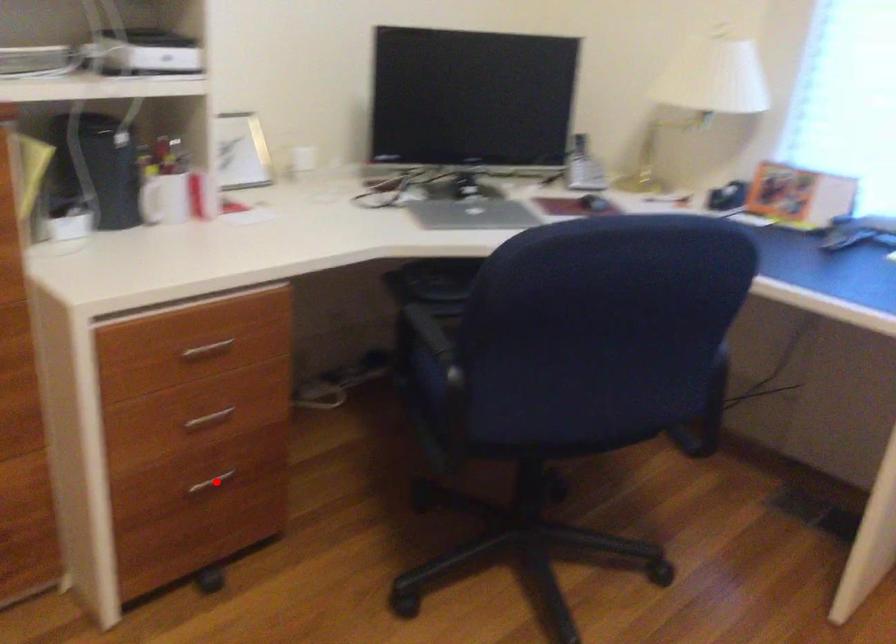
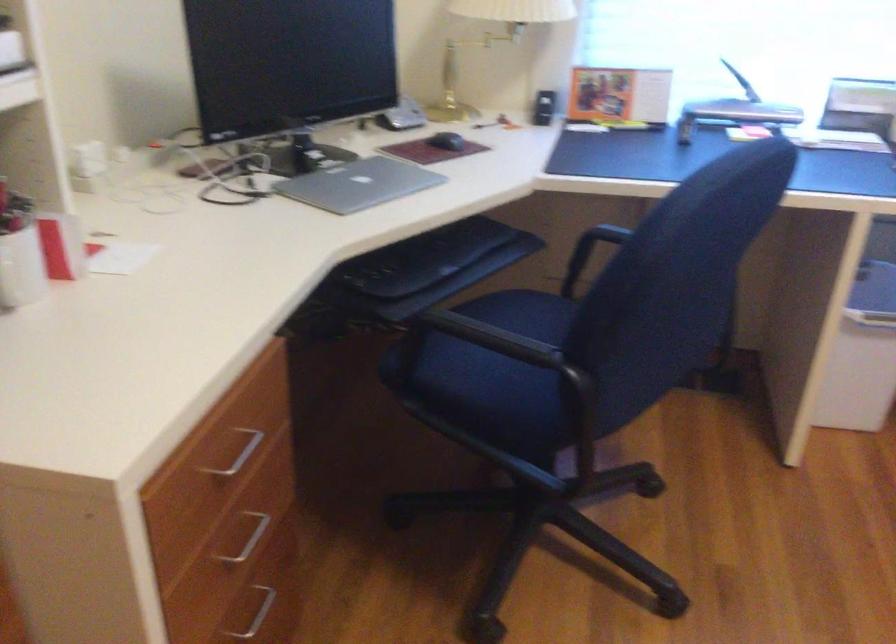
Question: I am providing you with two images of the same scene from different viewpoints. Given a red point in image1, look at the same physical point in image2. Is it:

Choices:
 (A) Closer to the viewpoint
 (B) Farther from the viewpoint

Answer: (A)